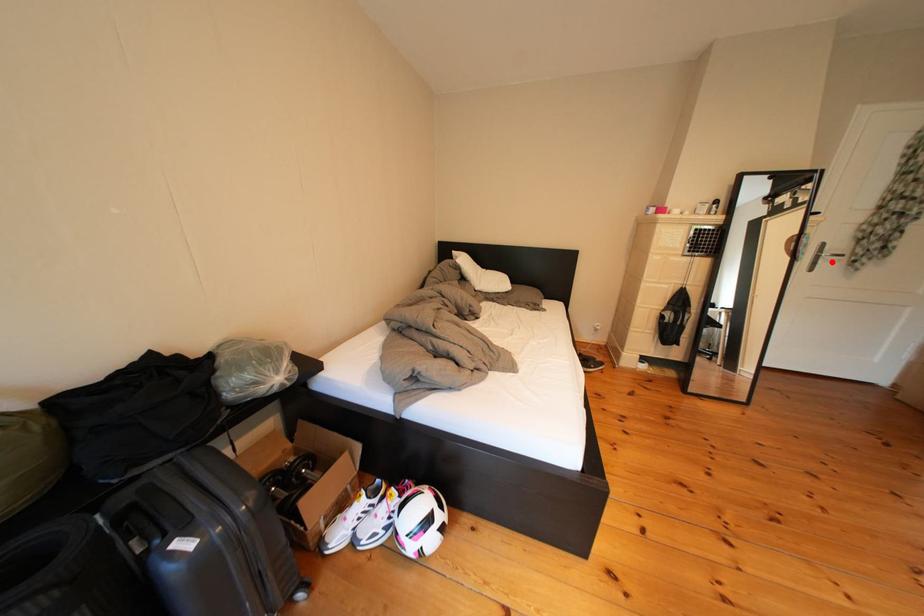
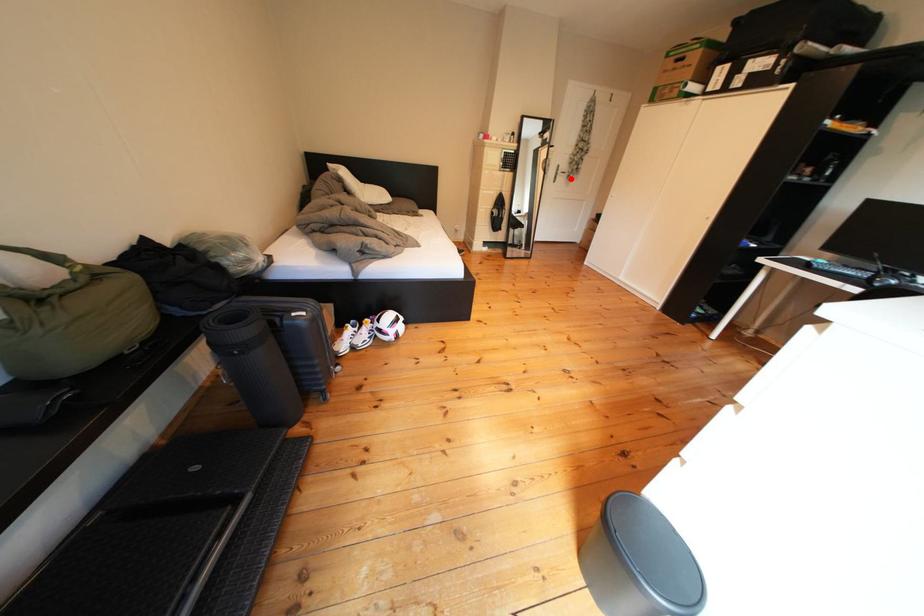
I am providing you with two images of the same scene from different viewpoints. A red point is marked on the first image and another point is marked on the second image. Does the point marked in image1 correspond to the same location as the one in image2?

Yes